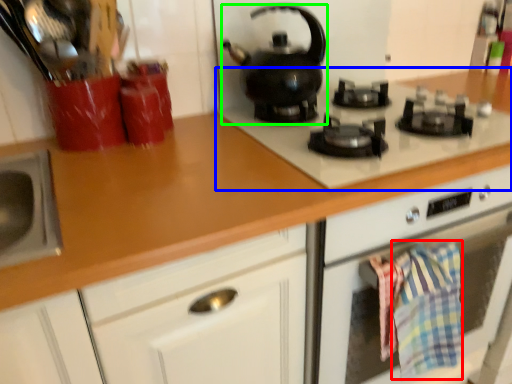
Question: Which is farther away from blanket (highlighted by a red box)? gas stove (highlighted by a blue box) or kitchen appliance (highlighted by a green box)?

Choices:
 (A) gas stove
 (B) kitchen appliance

Answer: (B)